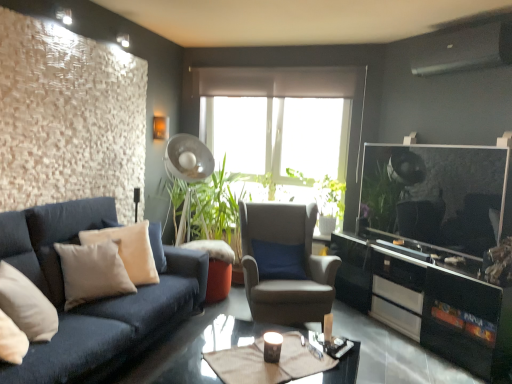
Question: Considering the relative sizes of beige fabric pillow at left, positioned as the second pillow in front-to-back order, and shiny black glass coffee table at center in the image provided, is beige fabric pillow at left, positioned as the second pillow in front-to-back order, thinner than shiny black glass coffee table at center?

Choices:
 (A) yes
 (B) no

Answer: (A)

Question: Is beige fabric pillow at left, the first pillow viewed from the back, positioned with its back to shiny black glass coffee table at center?

Choices:
 (A) no
 (B) yes

Answer: (A)

Question: Is shiny black glass coffee table at center completely or partially inside beige fabric pillow at left, the first pillow viewed from the back?

Choices:
 (A) no
 (B) yes

Answer: (A)

Question: From the image's perspective, would you say beige fabric pillow at left, the first pillow viewed from the back, is shown under shiny black glass coffee table at center?

Choices:
 (A) yes
 (B) no

Answer: (B)

Question: From a real-world perspective, is beige fabric pillow at left, the first pillow viewed from the back, below shiny black glass coffee table at center?

Choices:
 (A) no
 (B) yes

Answer: (A)

Question: Based on their positions, is beige fabric pillow at left, the first pillow viewed from the back, located to the left or right of black glossy cabinet at right?

Choices:
 (A) right
 (B) left

Answer: (B)

Question: Is point (137, 251) closer or farther from the camera than point (451, 317)?

Choices:
 (A) farther
 (B) closer

Answer: (A)

Question: Which is correct: beige fabric pillow at left, positioned as the second pillow in front-to-back order, is inside black glossy cabinet at right, or outside of it?

Choices:
 (A) inside
 (B) outside

Answer: (B)

Question: Considering the positions of beige fabric pillow at left, the first pillow viewed from the back, and black glossy cabinet at right in the image, is beige fabric pillow at left, the first pillow viewed from the back, taller or shorter than black glossy cabinet at right?

Choices:
 (A) tall
 (B) short

Answer: (B)

Question: From a real-world perspective, relative to metallic silver fan at center, is suede-like gray armchair at center vertically above or below?

Choices:
 (A) below
 (B) above

Answer: (A)

Question: Is suede-like gray armchair at center in front of or behind metallic silver fan at center in the image?

Choices:
 (A) behind
 (B) front

Answer: (B)

Question: From the image's perspective, relative to metallic silver fan at center, is suede-like gray armchair at center above or below?

Choices:
 (A) above
 (B) below

Answer: (B)

Question: Is suede-like gray armchair at center wider or thinner than metallic silver fan at center?

Choices:
 (A) thin
 (B) wide

Answer: (B)

Question: Is metallic silver fan at center spatially inside beige fabric pillow at left, positioned as the second pillow in front-to-back order, or outside of it?

Choices:
 (A) inside
 (B) outside

Answer: (B)

Question: In terms of height, does metallic silver fan at center look taller or shorter compared to beige fabric pillow at left, the first pillow viewed from the back?

Choices:
 (A) short
 (B) tall

Answer: (B)